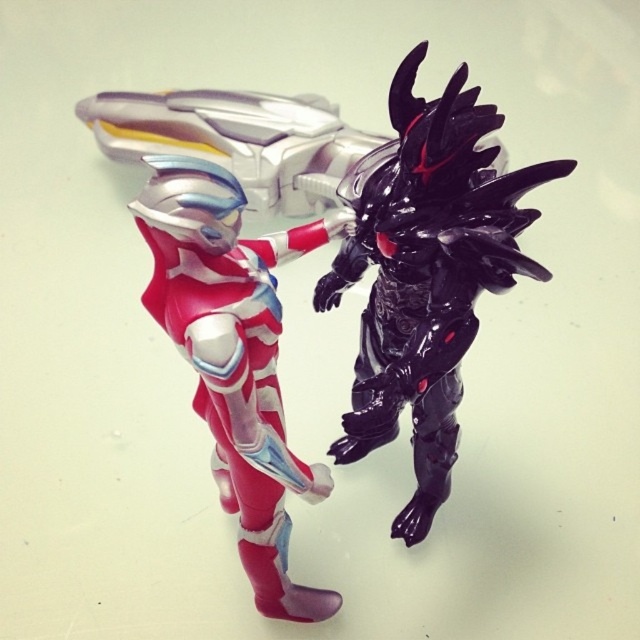
You are an engineer inspecting two shiny metallic objects displayed in a museum. The scene shows a shiny metallic robot at center and a shiny metallic suit at center. Which object is taller?

The shiny metallic robot at center is taller than the shiny metallic suit at center.

You are a collector who wants to display both the shiny metallic robot at center and the shiny metallic suit at center on a shelf. Given that the shelf has limited space, which object should you place first to ensure both fit?

The shiny metallic robot at center is larger in size than the shiny metallic suit at center. Therefore, you should place the shiny metallic robot at center first to ensure both fit on the shelf.

You are a collector trying to arrange these figures on a shelf. If you want to place the glossy black figure at right in front of the shiny metallic suit at center, is that possible based on their current positions?

The shiny metallic suit at center is currently behind the glossy black figure at right, so yes, you can move the glossy black figure at right to be in front of the shiny metallic suit at center since their positions can be adjusted.